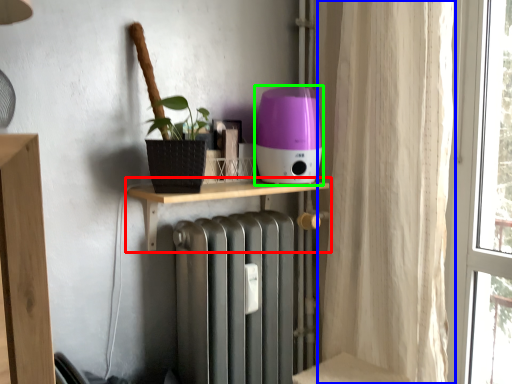
Question: Which object is positioned closest to shelf (highlighted by a red box)? Select from curtain (highlighted by a blue box) and appliance (highlighted by a green box).

Choices:
 (A) curtain
 (B) appliance

Answer: (B)